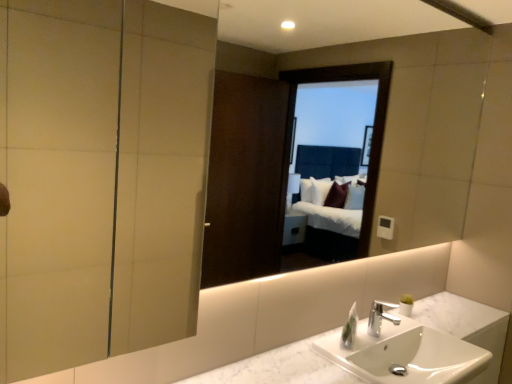
Question: Is silver metallic faucet at center positioned beyond the bounds of matte glass screen door at upper left?

Choices:
 (A) yes
 (B) no

Answer: (A)

Question: Are silver metallic faucet at center and matte glass screen door at upper left making contact?

Choices:
 (A) yes
 (B) no

Answer: (B)

Question: Is silver metallic faucet at center far away from matte glass screen door at upper left?

Choices:
 (A) yes
 (B) no

Answer: (A)

Question: From a real-world perspective, is silver metallic faucet at center physically below matte glass screen door at upper left?

Choices:
 (A) no
 (B) yes

Answer: (B)

Question: Is silver metallic faucet at center looking in the opposite direction of matte glass screen door at upper left?

Choices:
 (A) no
 (B) yes

Answer: (A)

Question: Is silver metallic faucet at center oriented towards matte glass screen door at upper left?

Choices:
 (A) yes
 (B) no

Answer: (B)

Question: Is white glossy soap dispenser at lower right to the left of matte glass screen door at upper left from the viewer's perspective?

Choices:
 (A) yes
 (B) no

Answer: (B)

Question: Is white glossy soap dispenser at lower right next to matte glass screen door at upper left?

Choices:
 (A) no
 (B) yes

Answer: (A)

Question: From a real-world perspective, is white glossy soap dispenser at lower right below matte glass screen door at upper left?

Choices:
 (A) no
 (B) yes

Answer: (B)

Question: Considering the relative positions of white glossy soap dispenser at lower right and matte glass screen door at upper left in the image provided, is white glossy soap dispenser at lower right to the right of matte glass screen door at upper left from the viewer's perspective?

Choices:
 (A) yes
 (B) no

Answer: (A)

Question: Is white glossy soap dispenser at lower right shorter than matte glass screen door at upper left?

Choices:
 (A) no
 (B) yes

Answer: (B)

Question: Is the position of white glossy soap dispenser at lower right less distant than that of matte glass screen door at upper left?

Choices:
 (A) no
 (B) yes

Answer: (A)

Question: Considering the relative positions of white marble counter top at center and silver metallic faucet at center in the image provided, is white marble counter top at center behind silver metallic faucet at center?

Choices:
 (A) yes
 (B) no

Answer: (B)